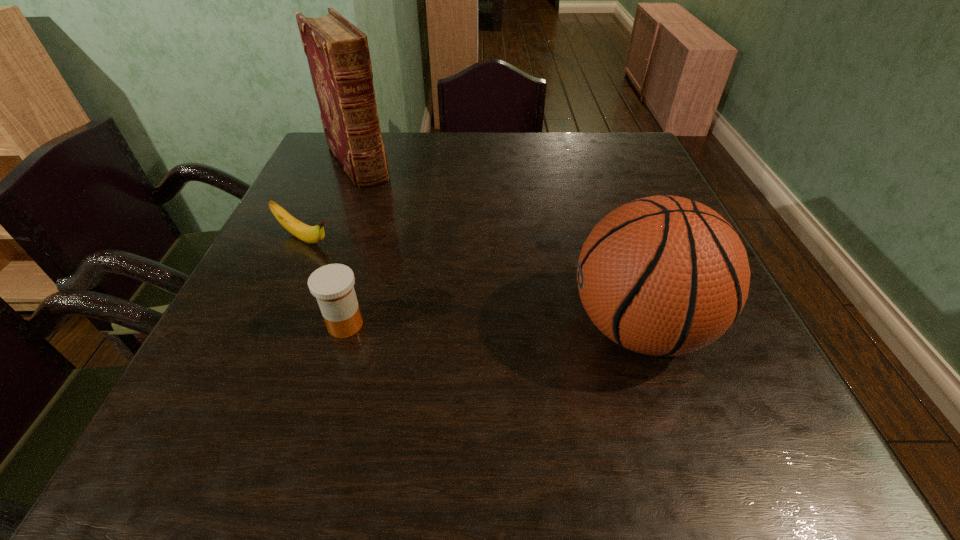
This screenshot has width=960, height=540. I want to click on free space on the desktop that is between the second shortest object and the basketball and is positioned on the spine side of the tallest object, so click(477, 326).

Where is `vacant space on the desktop that is between the medicine and the second tallest object and is positioned at the stem of the shortest object`? This screenshot has width=960, height=540. vacant space on the desktop that is between the medicine and the second tallest object and is positioned at the stem of the shortest object is located at coordinates (474, 326).